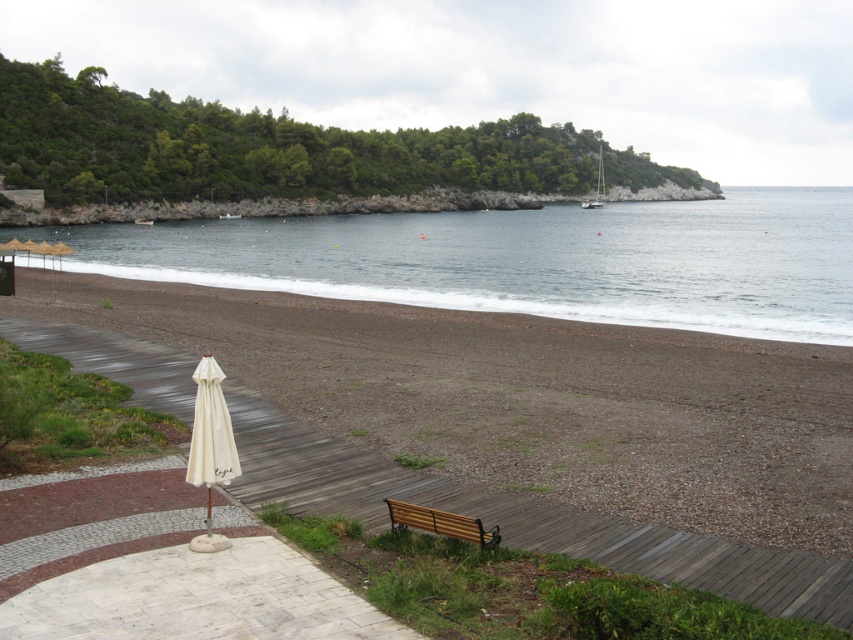
Can you confirm if brown wooden bench at center is thinner than blue water at center?

Yes.

Is brown wooden bench at center above blue water at center?

Actually, brown wooden bench at center is below blue water at center.

Who is more forward, (585, 513) or (228, 275)?

Point (585, 513)

Find the location of a particular element. brown wooden bench at center is located at coordinates (532, 426).

From the picture: Who is shorter, white fabric umbrella at lower left or brown wooden bench at lower center?

With less height is brown wooden bench at lower center.

Is white fabric umbrella at lower left closer to camera compared to brown wooden bench at lower center?

No, it is not.

Image resolution: width=853 pixels, height=640 pixels. Identify the location of white fabric umbrella at lower left. (212, 429).

Does brown wooden bench at center appear over white fabric umbrella at lower left?

Yes, brown wooden bench at center is above white fabric umbrella at lower left.

Between brown wooden bench at center and white fabric umbrella at lower left, which one is positioned lower?

white fabric umbrella at lower left

Identify the location of brown wooden bench at center. (532, 426).